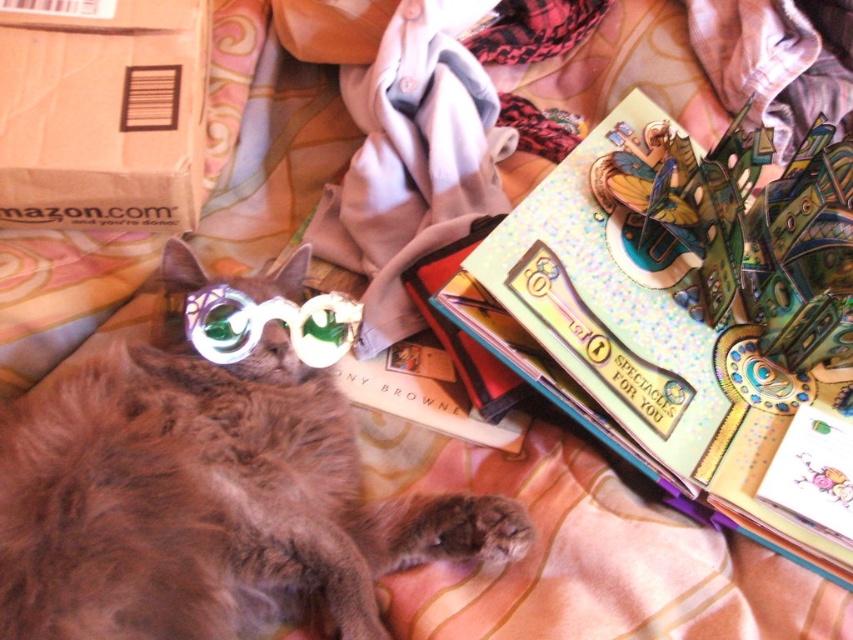
Question: Can you confirm if shiny metallic book at upper right is positioned below translucent plastic goggles at center?

Choices:
 (A) yes
 (B) no

Answer: (B)

Question: Estimate the real-world distances between objects in this image. Which object is closer to the shiny metallic book at upper right?

Choices:
 (A) metallic silver key at upper right
 (B) fuzzy brown cat at center
 (C) brown cardboard box at upper left
 (D) translucent plastic goggles at center

Answer: (A)

Question: Is shiny metallic book at upper right wider than brown cardboard box at upper left?

Choices:
 (A) no
 (B) yes

Answer: (B)

Question: Which object appears closest to the camera in this image?

Choices:
 (A) fuzzy brown cat at center
 (B) shiny metallic book at upper right

Answer: (A)

Question: Which of the following is the closest to the observer?

Choices:
 (A) fuzzy brown cat at center
 (B) shiny metallic book at upper right
 (C) metallic silver key at upper right

Answer: (A)

Question: In this image, where is brown cardboard box at upper left located relative to metallic silver key at upper right?

Choices:
 (A) above
 (B) below

Answer: (B)